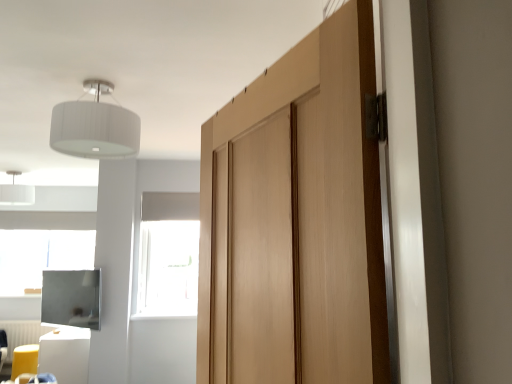
What do you see at coordinates (16, 192) in the screenshot? This screenshot has height=384, width=512. I see `white fabric lampshade at upper left, placed as the second light fixture when sorted from right to left` at bounding box center [16, 192].

Describe the element at coordinates (72, 298) in the screenshot. I see `matte black screen at lower left` at that location.

What do you see at coordinates (24, 360) in the screenshot?
I see `yellow fabric stool at lower left, acting as the 1th furniture starting from the left` at bounding box center [24, 360].

Consider the image. Measure the distance between point (97, 105) and camera.

Point (97, 105) and camera are 7.11 feet apart from each other.

Find the location of a particular element. The width and height of the screenshot is (512, 384). white glossy cube at lower left, which appears as the first furniture when viewed from the front is located at coordinates (65, 354).

From a real-world perspective, is matte black screen at lower left above or below white fabric lampshade at upper left, the 1th light fixture when ordered from front to back?

matte black screen at lower left is situated lower than white fabric lampshade at upper left, the 1th light fixture when ordered from front to back, in the real world.

From the image's perspective, is matte black screen at lower left below white fabric lampshade at upper left, arranged as the 2th light fixture when viewed from the left?

Yes, from the image's perspective, matte black screen at lower left is below white fabric lampshade at upper left, arranged as the 2th light fixture when viewed from the left.

Is point (74, 325) farther from camera compared to point (66, 107)?

That is True.

Which object is closer to the camera taking this photo, matte black screen at lower left or white fabric lampshade at upper left, the 1th light fixture when ordered from right to left?

white fabric lampshade at upper left, the 1th light fixture when ordered from right to left, is more forward.

Which object is more forward, yellow fabric stool at lower left, acting as the 1th furniture starting from the left, or white plastic radiator at lower left?

yellow fabric stool at lower left, acting as the 1th furniture starting from the left.

Can we say yellow fabric stool at lower left, arranged as the second furniture when viewed from the front, lies outside white plastic radiator at lower left?

That's correct, yellow fabric stool at lower left, arranged as the second furniture when viewed from the front, is outside of white plastic radiator at lower left.

From a real-world perspective, is yellow fabric stool at lower left, the second furniture in the right-to-left sequence, physically below white plastic radiator at lower left?

Yes.

From the image's perspective, is yellow fabric stool at lower left, the second furniture in the right-to-left sequence, above white plastic radiator at lower left?

No, from the image's perspective, yellow fabric stool at lower left, the second furniture in the right-to-left sequence, is not above white plastic radiator at lower left.

Consider the image. From a real-world perspective, is matte black screen at lower left physically located above or below yellow fabric stool at lower left, acting as the 1th furniture starting from the left?

From a real-world perspective, matte black screen at lower left is physically above yellow fabric stool at lower left, acting as the 1th furniture starting from the left.

Considering the relative positions of matte black screen at lower left and yellow fabric stool at lower left, the second furniture in the right-to-left sequence, in the image provided, is matte black screen at lower left in front of yellow fabric stool at lower left, the second furniture in the right-to-left sequence,?

That is True.

Looking at this image, could you tell me if matte black screen at lower left is facing yellow fabric stool at lower left, acting as the 1th furniture starting from the left?

No, matte black screen at lower left is not turned towards yellow fabric stool at lower left, acting as the 1th furniture starting from the left.

Which of these two, matte black screen at lower left or yellow fabric stool at lower left, arranged as the second furniture when viewed from the front, is thinner?

matte black screen at lower left.

Is white fabric lampshade at upper left, marked as the second light fixture in a top-to-bottom arrangement, thinner than natural wood door at center?

Incorrect, the width of white fabric lampshade at upper left, marked as the second light fixture in a top-to-bottom arrangement, is not less than that of natural wood door at center.

From a real-world perspective, is white fabric lampshade at upper left, acting as the first light fixture starting from the bottom, positioned under natural wood door at center based on gravity?

Actually, white fabric lampshade at upper left, acting as the first light fixture starting from the bottom, is physically above natural wood door at center in the real world.

Is white fabric lampshade at upper left, which ranks as the first light fixture in left-to-right order, spatially inside natural wood door at center, or outside of it?

white fabric lampshade at upper left, which ranks as the first light fixture in left-to-right order, cannot be found inside natural wood door at center.

The height and width of the screenshot is (384, 512). I want to click on door in front of the white fabric lampshade at upper left, placed as the second light fixture when sorted from right to left, so click(x=295, y=220).

From the picture: Can we say white fabric lampshade at upper left, the 1th light fixture viewed from the back, lies outside matte black screen at lower left?

Yes, white fabric lampshade at upper left, the 1th light fixture viewed from the back, is not within matte black screen at lower left.

Does white fabric lampshade at upper left, acting as the first light fixture starting from the bottom, turn towards matte black screen at lower left?

No, white fabric lampshade at upper left, acting as the first light fixture starting from the bottom, is not turned towards matte black screen at lower left.

Which of these two, white fabric lampshade at upper left, placed as the second light fixture when sorted from right to left, or matte black screen at lower left, stands taller?

With more height is matte black screen at lower left.

Does white fabric lampshade at upper left, the 1th light fixture viewed from the back, touch matte black screen at lower left?

No, white fabric lampshade at upper left, the 1th light fixture viewed from the back, is not making contact with matte black screen at lower left.

Find the location of `door on the right of matte black screen at lower left`. door on the right of matte black screen at lower left is located at coordinates (295, 220).

Is point (322, 171) positioned behind point (41, 319)?

That is False.

Do you think natural wood door at center is within matte black screen at lower left, or outside of it?

natural wood door at center exists outside the volume of matte black screen at lower left.

Does point (49, 287) come farther from viewer compared to point (2, 326)?

That is False.

Is matte black screen at lower left inside or outside of white plastic radiator at lower left?

matte black screen at lower left is outside white plastic radiator at lower left.

How many degrees apart are the facing directions of matte black screen at lower left and white plastic radiator at lower left?

matte black screen at lower left and white plastic radiator at lower left are facing 41.3 degrees away from each other.

Where is `window screen lying on the right of white plastic radiator at lower left`? The height and width of the screenshot is (384, 512). window screen lying on the right of white plastic radiator at lower left is located at coordinates (72, 298).

This screenshot has width=512, height=384. Identify the location of light fixture on the right side of matte black screen at lower left. (95, 126).

Where is `furniture below the white plastic radiator at lower left (from the image's perspective)`? This screenshot has width=512, height=384. furniture below the white plastic radiator at lower left (from the image's perspective) is located at coordinates (24, 360).

Estimate the real-world distances between objects in this image. Which object is further from natural wood door at center, white plastic radiator at lower left or matte black screen at lower left?

Based on the image, white plastic radiator at lower left appears to be further to natural wood door at center.

Estimate the real-world distances between objects in this image. Which object is closer to matte black screen at lower left, yellow fabric stool at lower left, acting as the 1th furniture starting from the left, or white fabric lampshade at upper left, which ranks as the first light fixture in left-to-right order?

The object closer to matte black screen at lower left is yellow fabric stool at lower left, acting as the 1th furniture starting from the left.

Which object lies nearer to the anchor point matte black screen at lower left, white fabric lampshade at upper left, which ranks as the 1th light fixture in top-to-bottom order, or white fabric lampshade at upper left, which ranks as the first light fixture in left-to-right order?

white fabric lampshade at upper left, which ranks as the first light fixture in left-to-right order, is closer to matte black screen at lower left.

From the image, which object appears to be nearer to yellow fabric stool at lower left, the second furniture in the right-to-left sequence, transparent glass window at center or white glossy cube at lower left, marked as the 2th furniture in a back-to-front arrangement?

The object closer to yellow fabric stool at lower left, the second furniture in the right-to-left sequence, is white glossy cube at lower left, marked as the 2th furniture in a back-to-front arrangement.

Based on their spatial positions, is white glossy cube at lower left, acting as the 2th furniture starting from the left, or natural wood door at center further from yellow fabric stool at lower left, marked as the 1th furniture in a back-to-front arrangement?

natural wood door at center is positioned further to the anchor yellow fabric stool at lower left, marked as the 1th furniture in a back-to-front arrangement.

Based on their spatial positions, is natural wood door at center or white fabric lampshade at upper left, the 1th light fixture when ordered from right to left, closer to white fabric lampshade at upper left, which is the second light fixture from front to back?

Among the two, white fabric lampshade at upper left, the 1th light fixture when ordered from right to left, is located nearer to white fabric lampshade at upper left, which is the second light fixture from front to back.

Which object lies nearer to the anchor point white glossy cube at lower left, marked as the 2th furniture in a back-to-front arrangement, yellow fabric stool at lower left, marked as the 1th furniture in a back-to-front arrangement, or white fabric lampshade at upper left, acting as the second light fixture starting from the back?

yellow fabric stool at lower left, marked as the 1th furniture in a back-to-front arrangement, is closer to white glossy cube at lower left, marked as the 2th furniture in a back-to-front arrangement.

Based on their spatial positions, is transparent glass window at center or white plastic radiator at lower left further from white fabric lampshade at upper left, which is the second light fixture from front to back?

transparent glass window at center.

Where is `window screen located between natural wood door at center and yellow fabric stool at lower left, acting as the 1th furniture starting from the left, in the depth direction`? window screen located between natural wood door at center and yellow fabric stool at lower left, acting as the 1th furniture starting from the left, in the depth direction is located at coordinates (72, 298).

I want to click on light fixture between natural wood door at center and transparent glass window at center along the z-axis, so click(x=95, y=126).

At what (x,y) coordinates should I click in order to perform the action: click on window screen between white fabric lampshade at upper left, placed as the second light fixture when sorted from right to left, and yellow fabric stool at lower left, acting as the 1th furniture starting from the left, in the up-down direction. Please return your answer as a coordinate pair (x, y). The height and width of the screenshot is (384, 512). Looking at the image, I should click on (72, 298).

Image resolution: width=512 pixels, height=384 pixels. I want to click on window screen between white plastic radiator at lower left and transparent glass window at center in the horizontal direction, so click(72, 298).